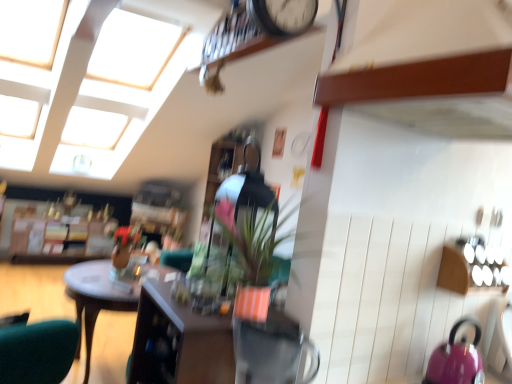
Question: Does pink glossy kettle at lower right have a lesser height compared to matte orange pot at center?

Choices:
 (A) yes
 (B) no

Answer: (A)

Question: Can you confirm if pink glossy kettle at lower right is taller than matte orange pot at center?

Choices:
 (A) yes
 (B) no

Answer: (B)

Question: Considering the relative sizes of pink glossy kettle at lower right and matte orange pot at center in the image provided, is pink glossy kettle at lower right bigger than matte orange pot at center?

Choices:
 (A) no
 (B) yes

Answer: (A)

Question: Is pink glossy kettle at lower right to the right of matte orange pot at center from the viewer's perspective?

Choices:
 (A) yes
 (B) no

Answer: (A)

Question: Is pink glossy kettle at lower right positioned behind matte orange pot at center?

Choices:
 (A) no
 (B) yes

Answer: (A)

Question: Relative to matte wooden cabinet at center, is pink glossy kettle at lower right in front or behind?

Choices:
 (A) front
 (B) behind

Answer: (B)

Question: Is pink glossy kettle at lower right taller or shorter than matte wooden cabinet at center?

Choices:
 (A) short
 (B) tall

Answer: (A)

Question: From a real-world perspective, is pink glossy kettle at lower right positioned above or below matte wooden cabinet at center?

Choices:
 (A) above
 (B) below

Answer: (A)

Question: Looking at their shapes, would you say pink glossy kettle at lower right is wider or thinner than matte wooden cabinet at center?

Choices:
 (A) wide
 (B) thin

Answer: (B)

Question: Considering the positions of pink glossy kettle at lower right and wooden desk at center in the image, is pink glossy kettle at lower right wider or thinner than wooden desk at center?

Choices:
 (A) thin
 (B) wide

Answer: (A)

Question: Based on their positions, is pink glossy kettle at lower right located to the left or right of wooden desk at center?

Choices:
 (A) left
 (B) right

Answer: (B)

Question: From the image's perspective, relative to wooden desk at center, is pink glossy kettle at lower right above or below?

Choices:
 (A) below
 (B) above

Answer: (B)

Question: Would you say pink glossy kettle at lower right is inside or outside wooden desk at center?

Choices:
 (A) inside
 (B) outside

Answer: (B)

Question: In the image, is matte orange pot at center positioned in front of or behind pink glossy kettle at lower right?

Choices:
 (A) front
 (B) behind

Answer: (B)

Question: Considering the positions of matte orange pot at center and pink glossy kettle at lower right in the image, is matte orange pot at center wider or thinner than pink glossy kettle at lower right?

Choices:
 (A) wide
 (B) thin

Answer: (A)